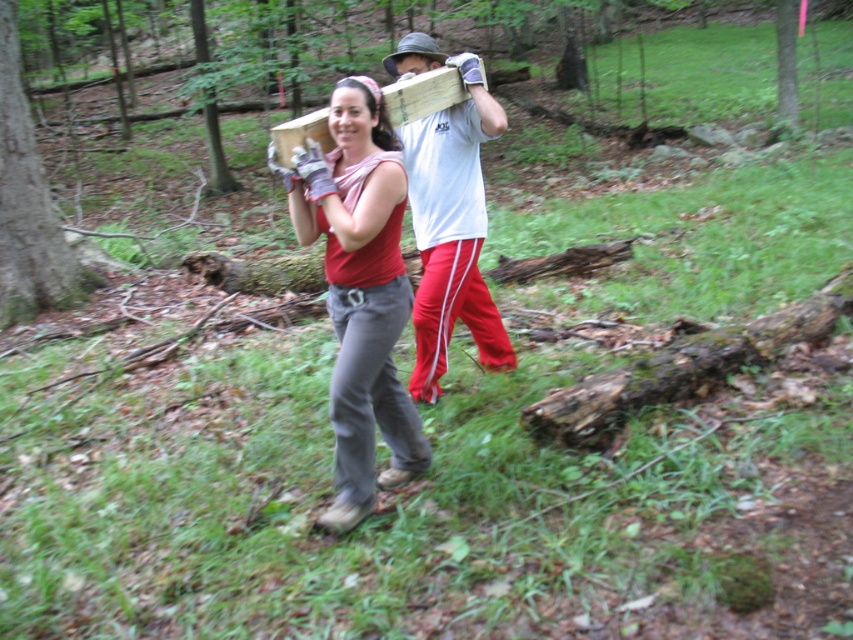
Question: Which point is farther to the camera?

Choices:
 (A) white cotton t-shirt at center
 (B) matte red tank top at center

Answer: (A)

Question: Which object appears farthest from the camera in this image?

Choices:
 (A) matte red tank top at center
 (B) white cotton t-shirt at center

Answer: (B)

Question: Where is matte red tank top at center located in relation to white cotton t-shirt at center in the image?

Choices:
 (A) below
 (B) above

Answer: (A)

Question: Which of the following is the closest to the observer?

Choices:
 (A) matte red tank top at center
 (B) white cotton t-shirt at center

Answer: (A)

Question: Can you confirm if matte red tank top at center is bigger than white cotton t-shirt at center?

Choices:
 (A) no
 (B) yes

Answer: (A)

Question: Can you confirm if matte red tank top at center is thinner than white cotton t-shirt at center?

Choices:
 (A) no
 (B) yes

Answer: (B)